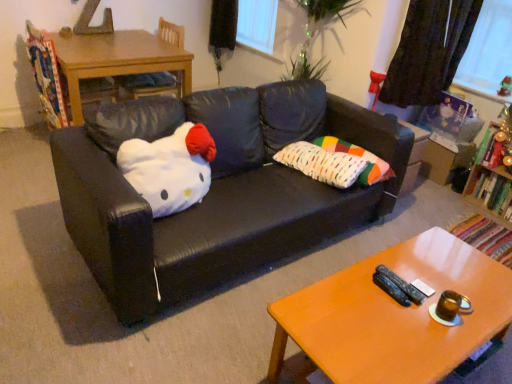
Question: Does black leather couch at center have a lesser width compared to wooden bookshelf at right?

Choices:
 (A) no
 (B) yes

Answer: (A)

Question: Are black leather couch at center and wooden bookshelf at right located far from each other?

Choices:
 (A) yes
 (B) no

Answer: (A)

Question: From a real-world perspective, is black leather couch at center under wooden bookshelf at right?

Choices:
 (A) no
 (B) yes

Answer: (A)

Question: Is wooden bookshelf at right completely or partially inside black leather couch at center?

Choices:
 (A) yes
 (B) no

Answer: (B)

Question: From a real-world perspective, is black leather couch at center on top of wooden bookshelf at right?

Choices:
 (A) no
 (B) yes

Answer: (B)

Question: Is shiny metallic candle at right, the second toy from the back, to the left or to the right of white plush at center in the image?

Choices:
 (A) right
 (B) left

Answer: (A)

Question: From a real-world perspective, is shiny metallic candle at right, which is the second toy from top to bottom, physically located above or below white plush at center?

Choices:
 (A) above
 (B) below

Answer: (B)

Question: In the image, is shiny metallic candle at right, the second toy from the back, positioned in front of or behind white plush at center?

Choices:
 (A) behind
 (B) front

Answer: (A)

Question: Is shiny metallic candle at right, which is the second toy from top to bottom, inside the boundaries of white plush at center, or outside?

Choices:
 (A) outside
 (B) inside

Answer: (A)

Question: Would you say multicolored fabric pillow at center, which appears as the 2th pillow when viewed from the right, is to the left or to the right of multicolored fabric pillow at center, positioned as the 2th pillow in left-to-right order, in the picture?

Choices:
 (A) left
 (B) right

Answer: (A)

Question: From a real-world perspective, is multicolored fabric pillow at center, which appears as the 2th pillow when viewed from the right, positioned above or below multicolored fabric pillow at center, placed as the first pillow when sorted from right to left?

Choices:
 (A) above
 (B) below

Answer: (A)

Question: Is multicolored fabric pillow at center, the first pillow from the left, spatially inside multicolored fabric pillow at center, positioned as the 2th pillow in left-to-right order, or outside of it?

Choices:
 (A) outside
 (B) inside

Answer: (A)

Question: Considering the positions of multicolored fabric pillow at center, which appears as the 2th pillow when viewed from the right, and multicolored fabric pillow at center, placed as the first pillow when sorted from right to left, in the image, is multicolored fabric pillow at center, which appears as the 2th pillow when viewed from the right, wider or thinner than multicolored fabric pillow at center, placed as the first pillow when sorted from right to left,?

Choices:
 (A) wide
 (B) thin

Answer: (A)

Question: Considering the positions of point (116, 66) and point (480, 3), is point (116, 66) closer or farther from the camera than point (480, 3)?

Choices:
 (A) closer
 (B) farther

Answer: (A)

Question: From the image's perspective, is wooden table at left located above or below dark fabric curtain at upper right?

Choices:
 (A) below
 (B) above

Answer: (A)